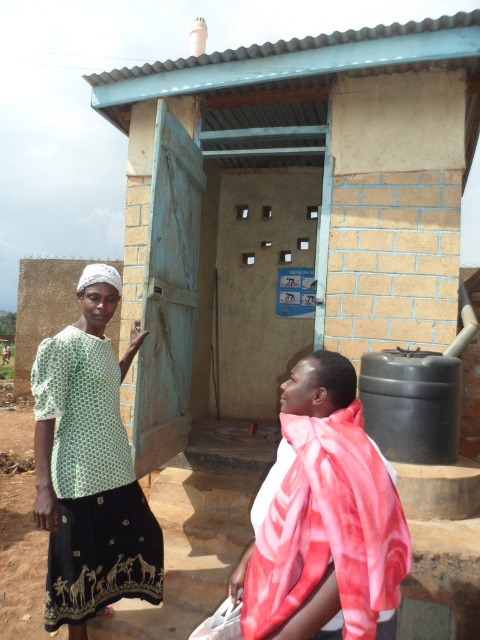
Is green dotted blouse at center thinner than floral silk scarf at lower right?

Incorrect, green dotted blouse at center's width is not less than floral silk scarf at lower right's.

Which is behind, point (92, 438) or point (259, 621)?

Positioned behind is point (92, 438).

Where is `green dotted blouse at center`? This screenshot has width=480, height=640. green dotted blouse at center is located at coordinates (90, 467).